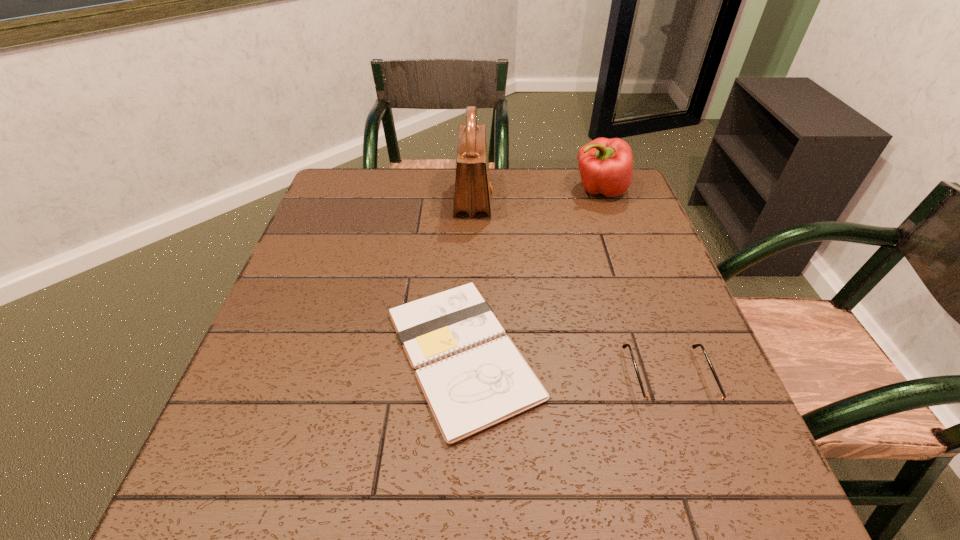
Identify the location of bell pepper at the right edge. This screenshot has width=960, height=540. [x=606, y=165].

At what (x,y) coordinates should I click in order to perform the action: click on spectacles positioned at the right edge. Please return your answer as a coordinate pair (x, y). The width and height of the screenshot is (960, 540). Looking at the image, I should click on (651, 403).

At what (x,y) coordinates should I click in order to perform the action: click on object located at the far right corner. Please return your answer as a coordinate pair (x, y). Looking at the image, I should click on (606, 165).

Where is `vacant space at the far edge of the desktop`? Image resolution: width=960 pixels, height=540 pixels. vacant space at the far edge of the desktop is located at coordinates (495, 184).

Find the location of a particular element. This screenshot has width=960, height=540. free space at the near edge of the desktop is located at coordinates (513, 497).

In the image, there is a desktop. Where is `vacant space at the left edge`? vacant space at the left edge is located at coordinates (307, 315).

The height and width of the screenshot is (540, 960). I want to click on free region at the right edge of the desktop, so click(x=644, y=224).

In the image, there is a desktop. Where is `vacant space at the far left corner`? vacant space at the far left corner is located at coordinates (329, 200).

In the image, there is a desktop. At what (x,y) coordinates should I click in order to perform the action: click on vacant region at the near right corner. Please return your answer as a coordinate pair (x, y). The width and height of the screenshot is (960, 540). Looking at the image, I should click on (748, 478).

I want to click on empty location between the spectacles and the tallest object, so click(570, 291).